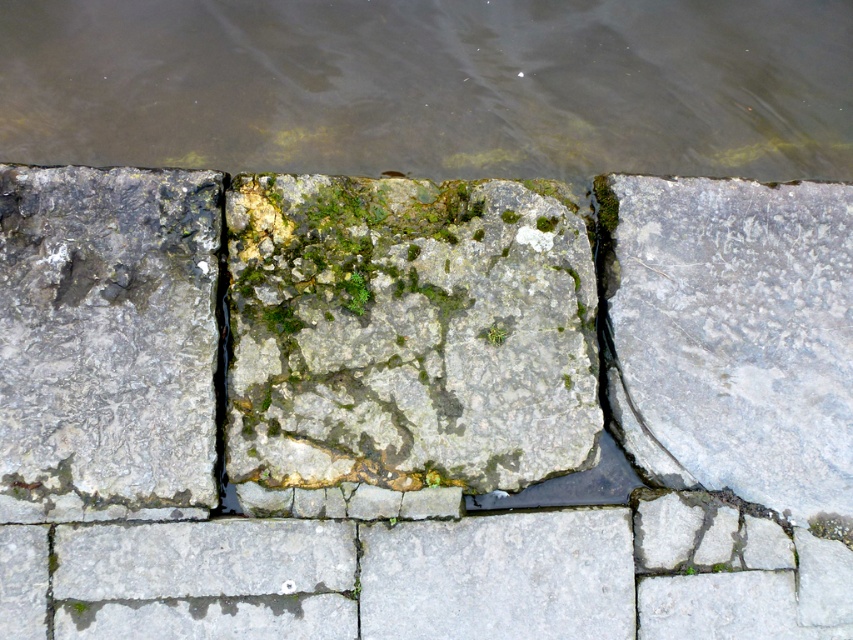
Can you confirm if brown murky water at upper center is smaller than gray rough stone at right?

No.

Is point (268, 136) in front of point (763, 396)?

No.

Does point (91, 88) come behind point (675, 444)?

Yes, it is.

Image resolution: width=853 pixels, height=640 pixels. I want to click on brown murky water at upper center, so click(x=432, y=86).

Who is taller, gray rough stone at center or gray rough stone at right?

Standing taller between the two is gray rough stone at right.

Who is more forward, (416, 227) or (700, 285)?

Point (416, 227) is more forward.

Identify the location of gray rough stone at center. The width and height of the screenshot is (853, 640). (408, 333).

Does gray stone at center have a smaller size compared to brown murky water at upper center?

No.

Locate an element on the screen. The height and width of the screenshot is (640, 853). gray stone at center is located at coordinates (419, 404).

Where is `gray stone at center`? The image size is (853, 640). gray stone at center is located at coordinates (419, 404).